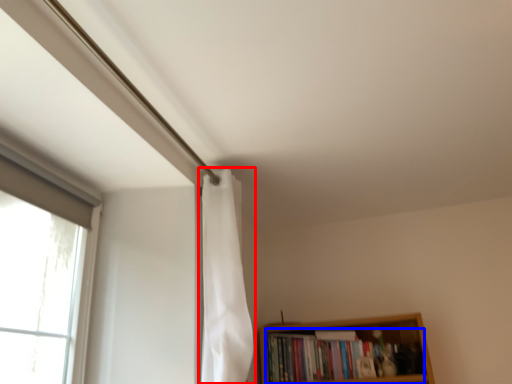
Question: Which object appears closest to the camera in this image, shower curtain (highlighted by a red box) or book (highlighted by a blue box)?

Choices:
 (A) shower curtain
 (B) book

Answer: (A)